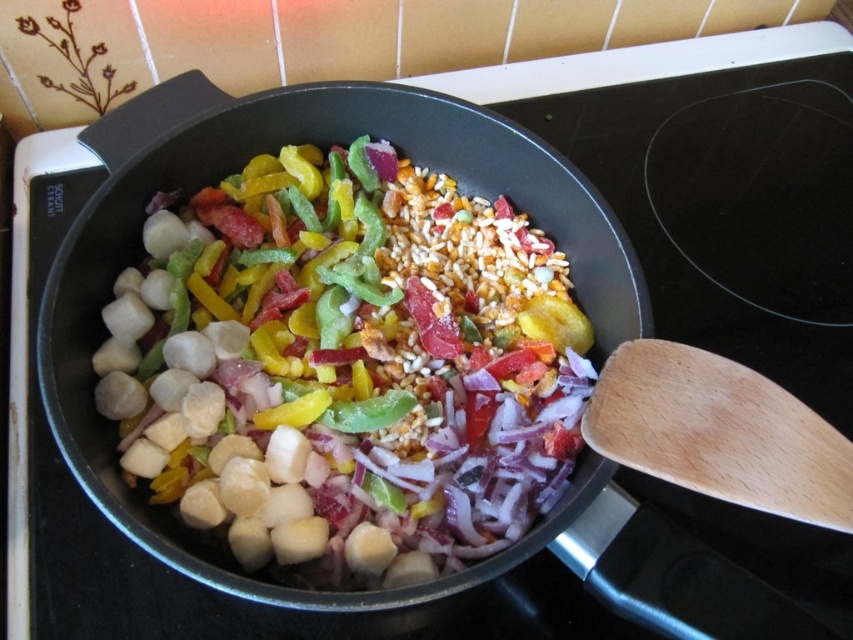
Which of these two, shiny metallic scallops at center or wooden spatula at right, stands shorter?

Standing shorter between the two is wooden spatula at right.

Is shiny metallic scallops at center positioned behind wooden spatula at right?

Yes, shiny metallic scallops at center is behind wooden spatula at right.

Identify the location of shiny metallic scallops at center. The height and width of the screenshot is (640, 853). (346, 365).